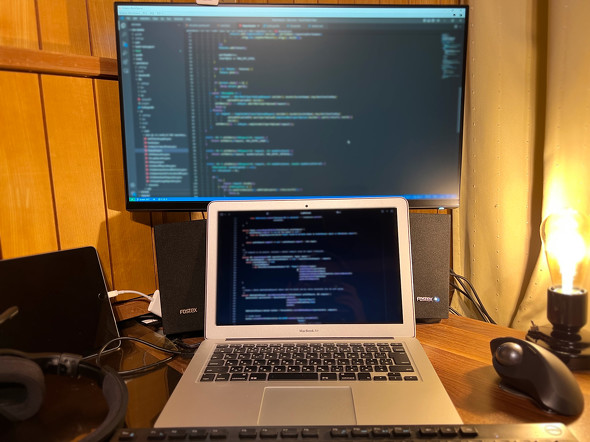
Find the location of a particular element. This screenshot has width=590, height=442. curtain is located at coordinates (497, 115).